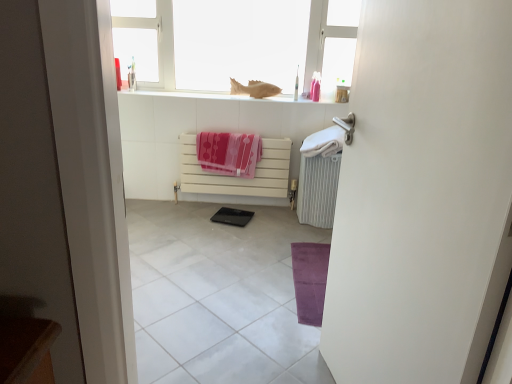
Identify the location of vacant space to the left of black glossy pad at center. (198, 211).